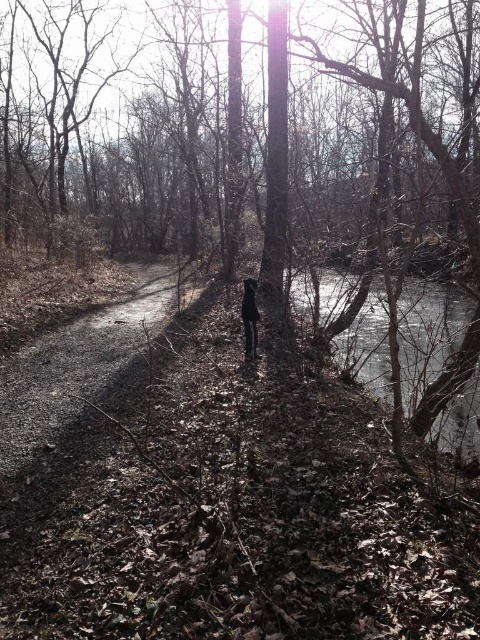
You are standing at point (428, 333) in the forest. To your right, there is clear water. Which direction should you walk to avoid stepping into the water?

You should walk away from the direction of the clear water at right to avoid stepping into it.

You are a hiker who has slipped and fallen into the clear water at right and the black leather pants at center. Which object is bigger in size?

The clear water at right is larger in size than the black leather pants at center.